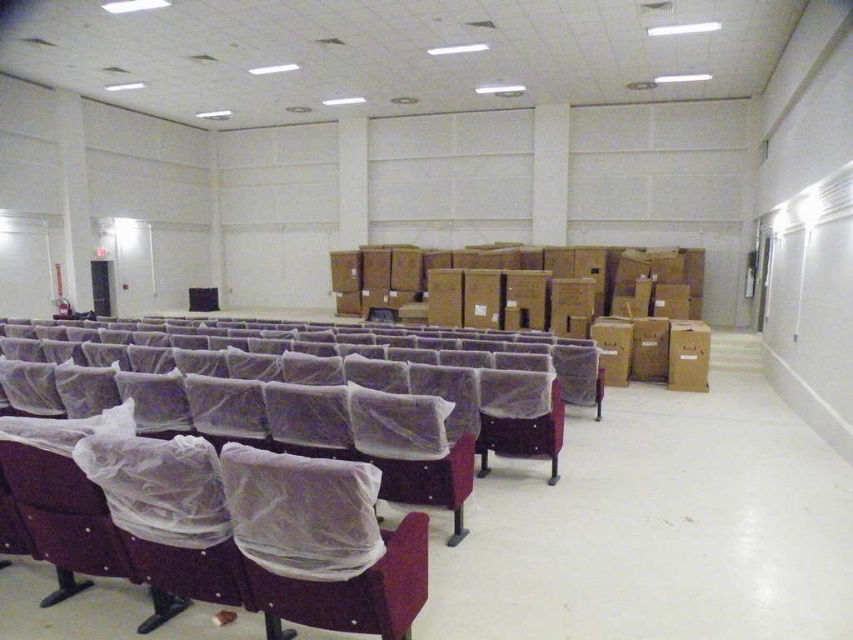
You are standing at the entrance of the lecture hall and see the point marked at coordinates (252, 474). What object is located at that point?

The point at coordinates (252, 474) corresponds to the matte purple chair at left.

You are standing at the entrance of the lecture hall and want to move towards the matte plastic chair at center. There is a matte purple chair at left in your path. Which chair should you move around to reach your destination?

You should move around the matte purple chair at left since it is closer to you and blocking the path to the matte plastic chair at center.